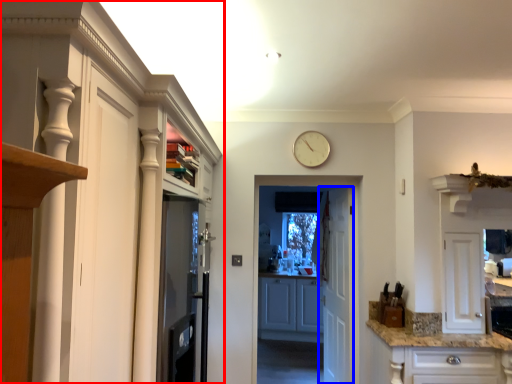
Question: Which object appears farthest to the camera in this image, cabinetry (highlighted by a red box) or door (highlighted by a blue box)?

Choices:
 (A) cabinetry
 (B) door

Answer: (B)